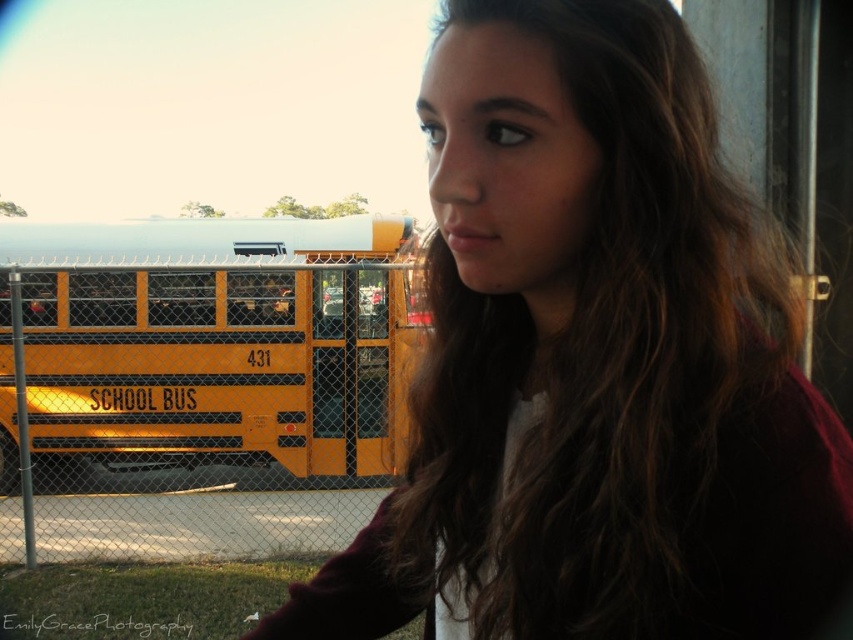
Question: Is matte yellow school bus at left positioned before yellow matte school bus at left?

Choices:
 (A) no
 (B) yes

Answer: (B)

Question: Which point is closer to the camera taking this photo?

Choices:
 (A) (399, 397)
 (B) (677, 45)

Answer: (B)

Question: Which of the following is the closest to the observer?

Choices:
 (A) matte yellow school bus at left
 (B) yellow matte school bus at left

Answer: (A)

Question: Does matte yellow school bus at left appear under yellow matte school bus at left?

Choices:
 (A) yes
 (B) no

Answer: (B)

Question: Is matte yellow school bus at left above yellow matte school bus at left?

Choices:
 (A) yes
 (B) no

Answer: (A)

Question: Which point is farther from the camera taking this photo?

Choices:
 (A) (523, 246)
 (B) (94, 248)

Answer: (B)